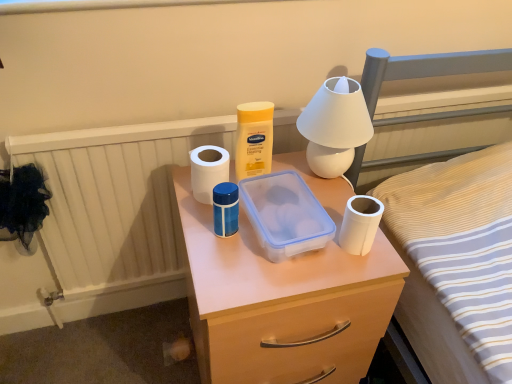
Identify the location of yellow plastic container at center. (254, 139).

Measure the distance between transparent plastic container at center and camera.

transparent plastic container at center and camera are 30.68 inches apart from each other.

What is the approximate height of white matte toilet paper at right, the second toilet paper in the back-to-front sequence?

It is 4.51 inches.

The width and height of the screenshot is (512, 384). I want to click on yellow plastic container at center, so click(254, 139).

Does white matte table lamp at upper center have a greater height compared to yellow plastic container at center?

Indeed, white matte table lamp at upper center has a greater height compared to yellow plastic container at center.

From the image's perspective, is white matte table lamp at upper center located above or below yellow plastic container at center?

white matte table lamp at upper center is situated higher than yellow plastic container at center in the image.

Is white matte table lamp at upper center to the left or to the right of yellow plastic container at center in the image?

white matte table lamp at upper center is to the right of yellow plastic container at center.

Which object is wider, white matte table lamp at upper center or yellow plastic container at center?

white matte table lamp at upper center is wider.

Can you confirm if yellow plastic container at center is positioned to the right of transparent plastic container at center?

In fact, yellow plastic container at center is to the left of transparent plastic container at center.

Does yellow plastic container at center have a lesser height compared to transparent plastic container at center?

No, yellow plastic container at center is not shorter than transparent plastic container at center.

Locate an element on the screen. This screenshot has width=512, height=384. storage box that appears on the right of yellow plastic container at center is located at coordinates (285, 214).

Considering the positions of objects white matte toilet paper at center, acting as the first toilet paper starting from the left, and translucent plastic container at center in the image provided, who is more to the right, white matte toilet paper at center, acting as the first toilet paper starting from the left, or translucent plastic container at center?

From the viewer's perspective, translucent plastic container at center appears more on the right side.

From the image's perspective, which is below, white matte toilet paper at center, placed as the second toilet paper when sorted from front to back, or translucent plastic container at center?

translucent plastic container at center, from the image's perspective.

From a real-world perspective, who is located lower, white matte toilet paper at center, arranged as the 1th toilet paper when viewed from the back, or translucent plastic container at center?

translucent plastic container at center is physically lower.

Does translucent plastic container at center have a lesser width compared to white matte toilet paper at center, placed as the second toilet paper when sorted from front to back?

In fact, translucent plastic container at center might be wider than white matte toilet paper at center, placed as the second toilet paper when sorted from front to back.

Considering the relative positions of translucent plastic container at center and white matte toilet paper at center, arranged as the 1th toilet paper when viewed from the back, in the image provided, is translucent plastic container at center behind white matte toilet paper at center, arranged as the 1th toilet paper when viewed from the back,?

That is False.

What's the angular difference between translucent plastic container at center and white matte toilet paper at center, placed as the second toilet paper when sorted from front to back,'s facing directions?

translucent plastic container at center and white matte toilet paper at center, placed as the second toilet paper when sorted from front to back, are facing 0.00189 degrees away from each other.

From a real-world perspective, is translucent plastic container at center under white matte toilet paper at center, placed as the second toilet paper when sorted from front to back?

Yes, from a real-world perspective, translucent plastic container at center is below white matte toilet paper at center, placed as the second toilet paper when sorted from front to back.

Consider the image. Is white matte toilet paper at center, arranged as the second toilet paper when viewed from the right, to the left of yellow plastic container at center from the viewer's perspective?

Correct, you'll find white matte toilet paper at center, arranged as the second toilet paper when viewed from the right, to the left of yellow plastic container at center.

Between point (212, 169) and point (261, 115), which one is positioned in front?

The point (212, 169) is in front.

Is white matte toilet paper at center, arranged as the second toilet paper when viewed from the right, not near yellow plastic container at center?

white matte toilet paper at center, arranged as the second toilet paper when viewed from the right, is near yellow plastic container at center, not far away.

How many degrees apart are the facing directions of white matte toilet paper at center, placed as the second toilet paper when sorted from front to back, and yellow plastic container at center?

They differ by 0.00525 degrees in their facing directions.

Choose the correct answer: Is translucent plastic container at center inside transparent plastic container at center or outside it?

translucent plastic container at center is outside transparent plastic container at center.

In the scene shown: From the image's perspective, is translucent plastic container at center under transparent plastic container at center?

Yes, from the image's perspective, translucent plastic container at center is below transparent plastic container at center.

In the image, is translucent plastic container at center positioned in front of or behind transparent plastic container at center?

translucent plastic container at center is positioned closer to the viewer than transparent plastic container at center.

Between point (274, 315) and point (327, 230), which one is positioned behind?

Point (327, 230)

Based on the photo, is transparent plastic container at center to the right of translucent plastic container at center from the viewer's perspective?

Indeed, transparent plastic container at center is positioned on the right side of translucent plastic container at center.

Does transparent plastic container at center touch translucent plastic container at center?

No, transparent plastic container at center is not next to translucent plastic container at center.

Considering the relative sizes of transparent plastic container at center and translucent plastic container at center in the image provided, is transparent plastic container at center thinner than translucent plastic container at center?

Indeed, transparent plastic container at center has a lesser width compared to translucent plastic container at center.

Which is in front, transparent plastic container at center or translucent plastic container at center?

translucent plastic container at center is more forward.

At what (x,y) coordinates should I click in order to perform the action: click on table lamp above the yellow plastic container at center (from a real-world perspective). Please return your answer as a coordinate pair (x, y). Looking at the image, I should click on (335, 126).

Locate an element on the screen. The width and height of the screenshot is (512, 384). storage box in front of the yellow plastic container at center is located at coordinates (285, 214).

Based on their spatial positions, is white matte table lamp at upper center or translucent plastic container at center closer to white matte toilet paper at center, arranged as the 1th toilet paper when viewed from the back?

Among the two, white matte table lamp at upper center is located nearer to white matte toilet paper at center, arranged as the 1th toilet paper when viewed from the back.

When comparing their distances from yellow plastic container at center, does white matte toilet paper at center, arranged as the 1th toilet paper when viewed from the back, or white matte table lamp at upper center seem further?

white matte table lamp at upper center.

From the image, which object appears to be farther from white matte toilet paper at right, the second toilet paper in the back-to-front sequence, translucent plastic container at center or white matte toilet paper at center, arranged as the second toilet paper when viewed from the right?

Based on the image, white matte toilet paper at center, arranged as the second toilet paper when viewed from the right, appears to be further to white matte toilet paper at right, the second toilet paper in the back-to-front sequence.

Based on their spatial positions, is yellow plastic container at center or white matte toilet paper at center, acting as the first toilet paper starting from the left, closer to transparent plastic container at center?

yellow plastic container at center lies closer to transparent plastic container at center than the other object.

When comparing their distances from translucent plastic container at center, does white matte table lamp at upper center or yellow plastic container at center seem further?

Based on the image, yellow plastic container at center appears to be further to translucent plastic container at center.

Based on their spatial positions, is yellow plastic container at center or translucent plastic container at center closer to transparent plastic container at center?

yellow plastic container at center is closer to transparent plastic container at center.

Estimate the real-world distances between objects in this image. Which object is closer to white matte toilet paper at center, arranged as the second toilet paper when viewed from the right, yellow plastic container at center or white matte table lamp at upper center?

yellow plastic container at center is closer to white matte toilet paper at center, arranged as the second toilet paper when viewed from the right.

Considering their positions, is translucent plastic container at center positioned further to transparent plastic container at center than yellow plastic container at center?

The object further to transparent plastic container at center is translucent plastic container at center.

Where is `storage box between white matte table lamp at upper center and translucent plastic container at center in the vertical direction`? storage box between white matte table lamp at upper center and translucent plastic container at center in the vertical direction is located at coordinates (285, 214).

Identify the location of cleaning product between white matte table lamp at upper center and translucent plastic container at center in the vertical direction. (254, 139).

The image size is (512, 384). In order to click on storage box between white matte toilet paper at center, acting as the first toilet paper starting from the left, and white matte toilet paper at right, the 1th toilet paper in the front-to-back sequence in this screenshot , I will do `click(285, 214)`.

This screenshot has width=512, height=384. Identify the location of storage box that lies between white matte toilet paper at center, arranged as the 1th toilet paper when viewed from the back, and translucent plastic container at center from top to bottom. (285, 214).